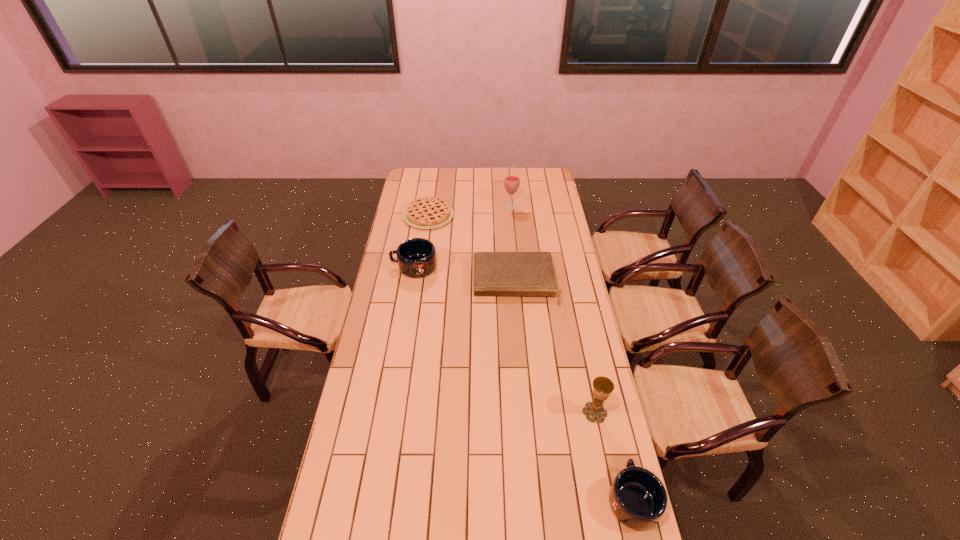
Find the location of a particular element. vacant space located with the handle on the side of the shorter mug is located at coordinates (608, 395).

In order to click on free region located 0.200m on the right of the wineglass in this screenshot , I will do [553, 207].

In order to click on free region located 0.220m on the spine side of the paperback book in this screenshot , I will do `click(521, 353)`.

Where is `vacant space located 0.300m on the front of the shortest object`? The width and height of the screenshot is (960, 540). vacant space located 0.300m on the front of the shortest object is located at coordinates (420, 268).

Identify the location of vacant region located 0.390m on the back of the chalice. (576, 321).

I want to click on object present at the near edge, so click(x=637, y=497).

You are a GUI agent. You are given a task and a screenshot of the screen. Output one action in this format:
    pyautogui.click(x=<x>, y=<y>)
    Task: Click on the mug situated at the left edge
    Image resolution: width=960 pixels, height=540 pixels.
    Given the screenshot: What is the action you would take?
    pyautogui.click(x=416, y=257)

This screenshot has width=960, height=540. Identify the location of pie situated at the left edge. (428, 212).

Where is `mug at the right edge`? mug at the right edge is located at coordinates (637, 497).

The width and height of the screenshot is (960, 540). I want to click on paperback book located in the right edge section of the desktop, so click(494, 273).